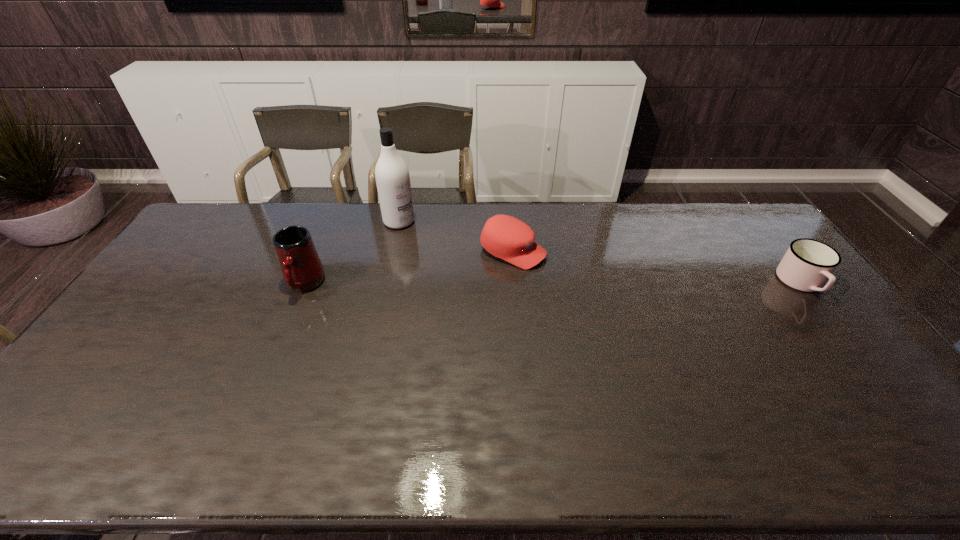
I want to click on free location located 0.240m on the front-facing side of the cap, so click(x=611, y=288).

Where is `vacant space located on the front-facing side of the cap`? This screenshot has width=960, height=540. vacant space located on the front-facing side of the cap is located at coordinates (645, 301).

The height and width of the screenshot is (540, 960). I want to click on vacant space located 0.170m on the front-facing side of the tallest object, so click(x=437, y=251).

You are a GUI agent. You are given a task and a screenshot of the screen. Output one action in this format:
    pyautogui.click(x=<x>, y=<y>)
    Task: Click on the vacant region located 0.080m on the front-facing side of the tallest object
    The width and height of the screenshot is (960, 540).
    Given the screenshot: What is the action you would take?
    pyautogui.click(x=421, y=239)

Find the location of a particular element. This screenshot has width=960, height=540. vacant space located on the front-facing side of the tallest object is located at coordinates (418, 236).

I want to click on cap that is at the far edge, so click(508, 238).

Image resolution: width=960 pixels, height=540 pixels. I want to click on shampoo at the far edge, so click(392, 176).

In order to click on object present at the right edge in this screenshot , I will do `click(806, 266)`.

You are a GUI agent. You are given a task and a screenshot of the screen. Output one action in this format:
    pyautogui.click(x=<x>, y=<y>)
    Task: Click on the free space at the far edge
    
    Given the screenshot: What is the action you would take?
    click(x=712, y=235)

Where is `vacant region at the near edge of the desktop`? The image size is (960, 540). vacant region at the near edge of the desktop is located at coordinates (199, 402).